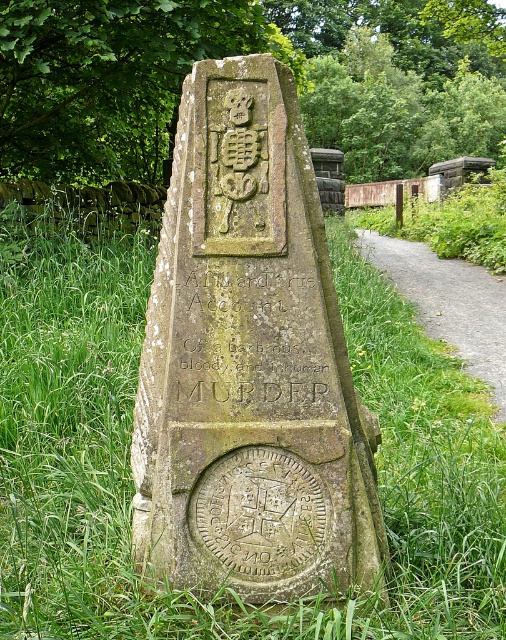
Question: Does green mossy stone at center have a greater width compared to green mossy stone monument at center?

Choices:
 (A) yes
 (B) no

Answer: (A)

Question: Which object is farther from the camera taking this photo?

Choices:
 (A) carved stone inscription at center
 (B) gravel path at right

Answer: (B)

Question: Where is green mossy stone at center located in relation to green stone carving at upper center in the image?

Choices:
 (A) below
 (B) above

Answer: (A)

Question: Which of the following is the closest to the observer?

Choices:
 (A) (330, 406)
 (B) (430, 273)
 (C) (168, 86)

Answer: (A)

Question: Among these points, which one is farthest from the camera?

Choices:
 (A) (256, 20)
 (B) (356, 228)

Answer: (B)

Question: Is green mossy stone at center smaller than green stone carving at upper center?

Choices:
 (A) yes
 (B) no

Answer: (B)